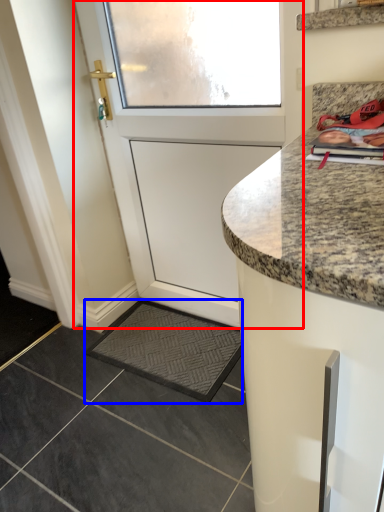
Question: Which point is further to the camera, door (highlighted by a red box) or slate (highlighted by a blue box)?

Choices:
 (A) door
 (B) slate

Answer: (B)